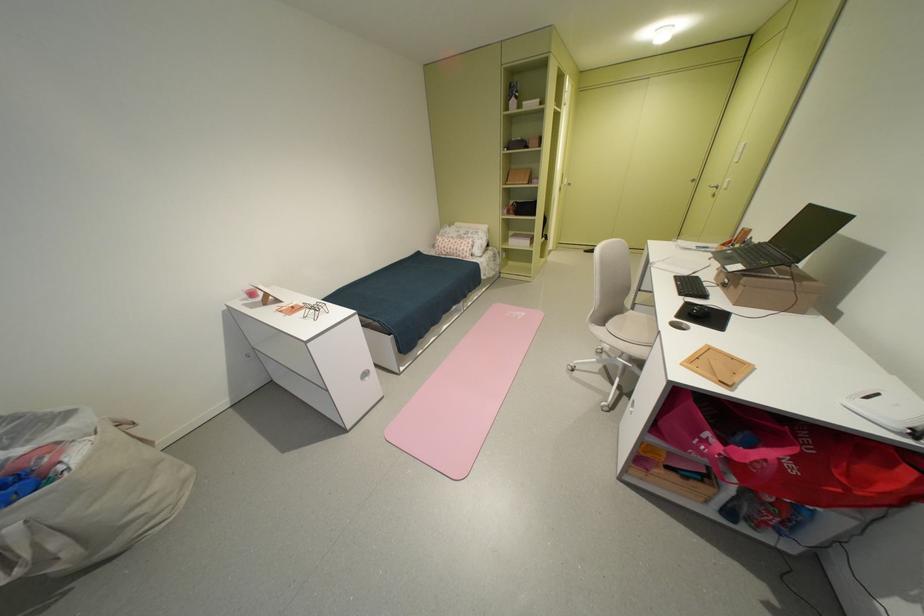
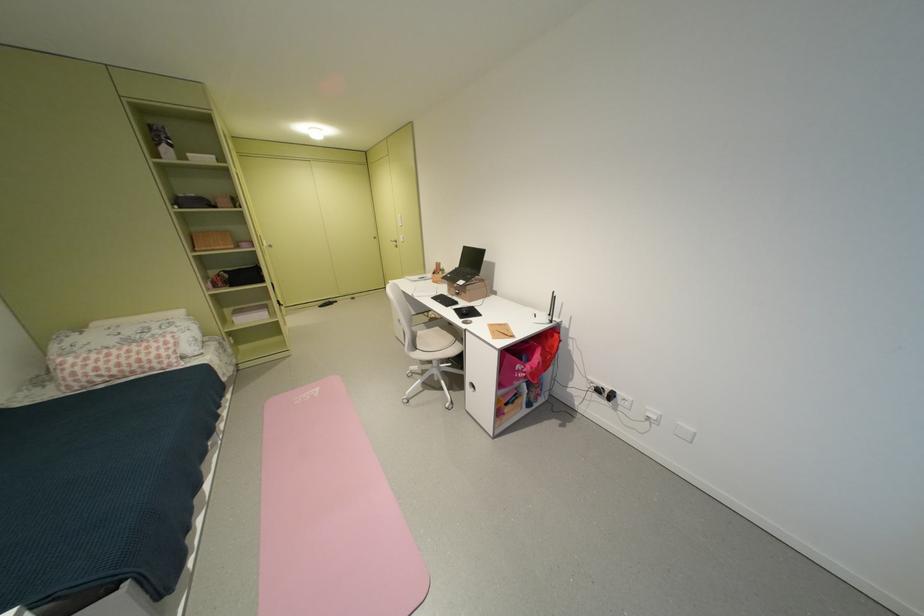
In the second image, find the point that corresponds to pixel 615 326 in the first image.

(428, 349)